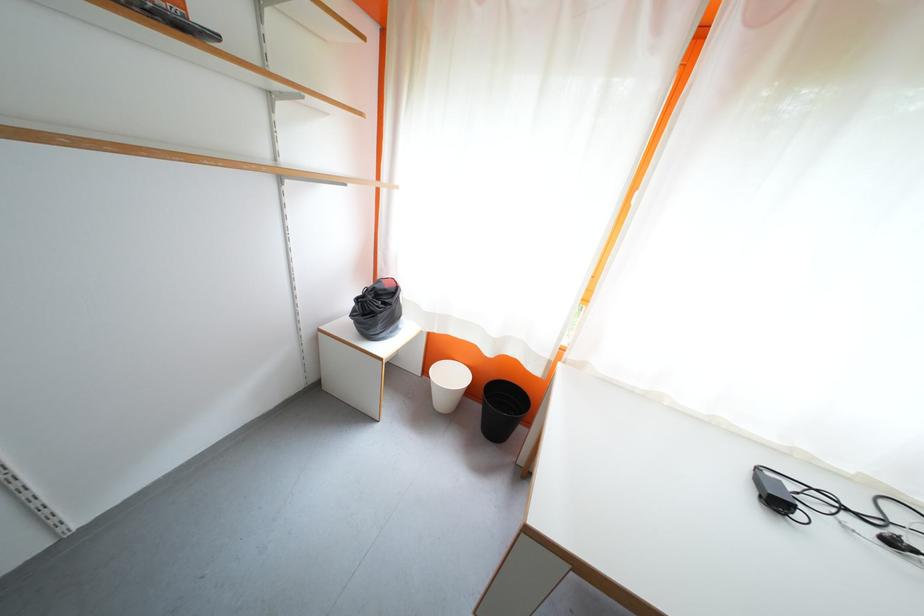
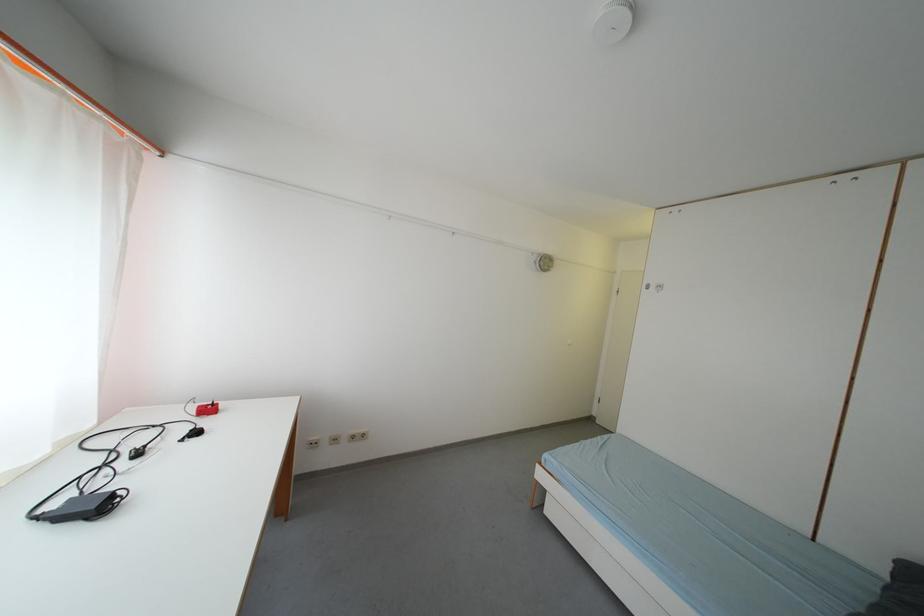
Locate, in the second image, the point that corresponds to (x=857, y=514) in the first image.

(112, 469)